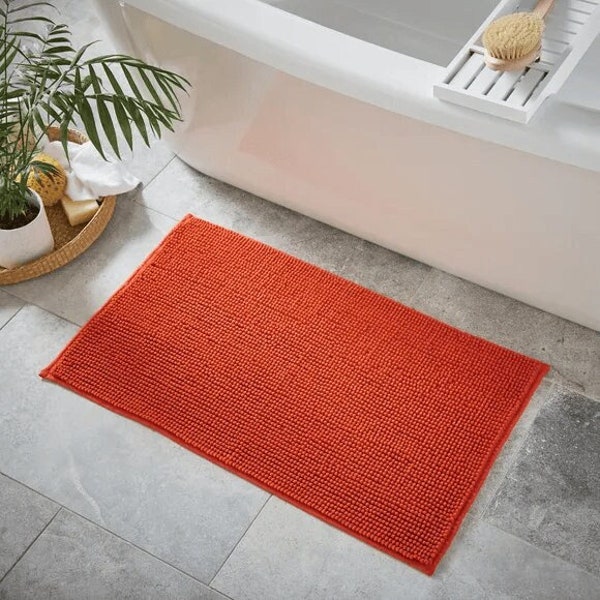
This screenshot has width=600, height=600. I want to click on bathtub caddy tray, so click(561, 44).